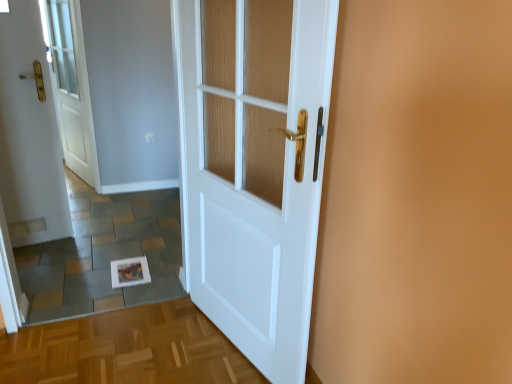
Find the location of a particular element. This screenshot has width=512, height=384. free space to the right of white glossy door at left, the second door in the right-to-left sequence is located at coordinates (89, 203).